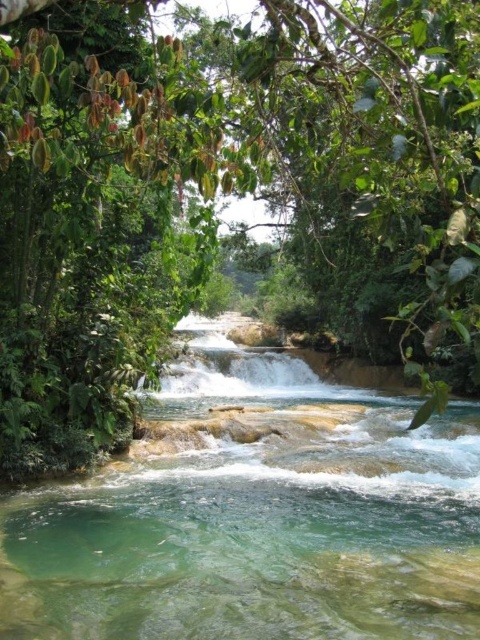
Does point (276, 275) come closer to viewer compared to point (322, 451)?

No, (276, 275) is further to viewer.

Which of these two, green leafy tree at center or clear water stream at center, stands taller?

With more height is green leafy tree at center.

Which is behind, point (29, 262) or point (51, 621)?

Positioned behind is point (29, 262).

What are the coordinates of `green leafy tree at center` in the screenshot? It's located at (232, 193).